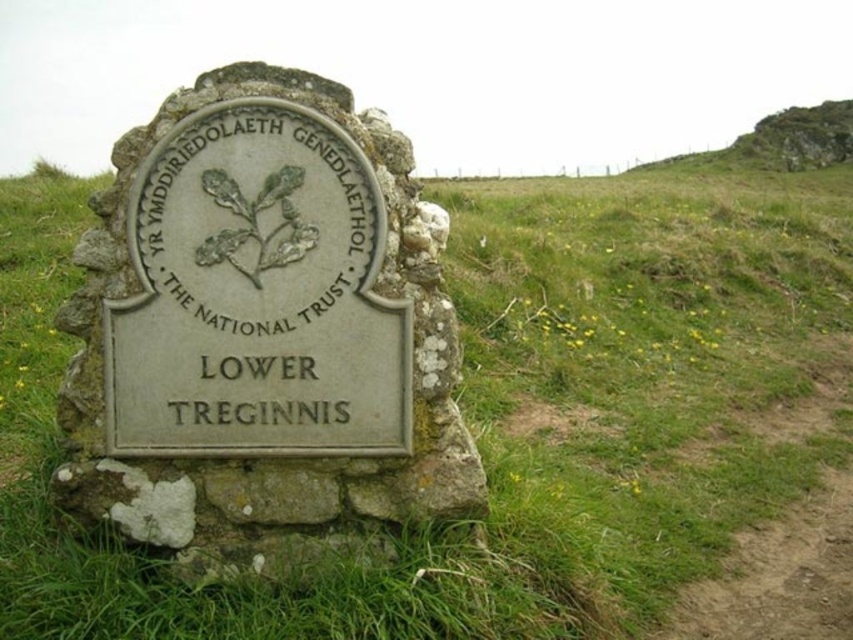
Between green grass at center and green stone plaque at center, which one is positioned higher?

green grass at center is higher up.

Is green grass at center to the left of green stone plaque at center from the viewer's perspective?

Incorrect, green grass at center is not on the left side of green stone plaque at center.

Is point (685, 276) more distant than point (140, 417)?

Yes.

Where is `green grass at center`? The width and height of the screenshot is (853, 640). green grass at center is located at coordinates (505, 410).

Is gray stone sign at center positioned behind green stone plaque at center?

No, gray stone sign at center is in front of green stone plaque at center.

Is point (386, 216) positioned after point (158, 148)?

Yes.

Is point (426, 476) positioned in front of point (198, 333)?

No, (426, 476) is behind (198, 333).

Identify the location of gray stone sign at center. The height and width of the screenshot is (640, 853). (263, 333).

Is gray stone sign at center shorter than green grassy hillside at upper right?

Incorrect, gray stone sign at center's height does not fall short of green grassy hillside at upper right's.

Does point (328, 280) lie in front of point (750, 164)?

Yes, it is.

This screenshot has height=640, width=853. I want to click on gray stone sign at center, so point(263,333).